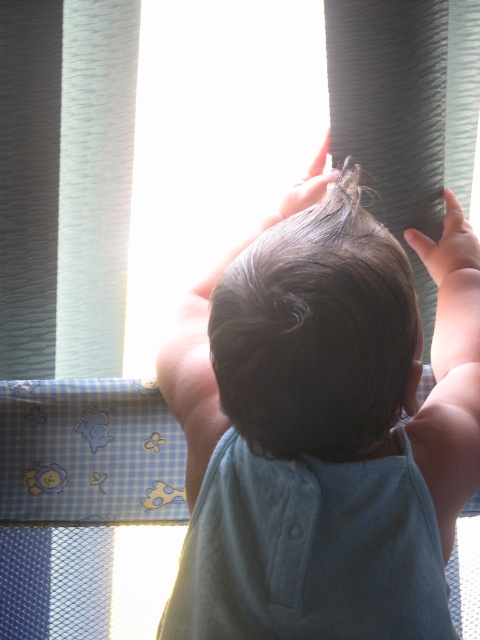
Between dark brown hair at center and smooth skin hand at upper right, which one appears on the left side from the viewer's perspective?

Positioned to the left is dark brown hair at center.

Does point (396, 365) come in front of point (440, 246)?

Yes, it is in front of point (440, 246).

The image size is (480, 640). Find the location of `dark brown hair at center`. dark brown hair at center is located at coordinates (320, 429).

This screenshot has width=480, height=640. Find the location of `dark brown hair at center`. dark brown hair at center is located at coordinates (320, 429).

Is dark brown hair at center smaller than dark brown smooth hair at center?

Incorrect, dark brown hair at center is not smaller in size than dark brown smooth hair at center.

Does point (279, 520) lie behind point (228, 353)?

Yes, point (279, 520) is behind point (228, 353).

Locate an element on the screen. The width and height of the screenshot is (480, 640). dark brown hair at center is located at coordinates (320, 429).

How far apart are dark brown smooth hair at center and smooth skin hand at upper right?

The distance of dark brown smooth hair at center from smooth skin hand at upper right is 13.41 inches.

Is dark brown smooth hair at center smaller than smooth skin hand at upper right?

No.

Locate an element on the screen. The height and width of the screenshot is (640, 480). dark brown smooth hair at center is located at coordinates (317, 332).

In order to click on dark brown smooth hair at center in this screenshot , I will do `click(317, 332)`.